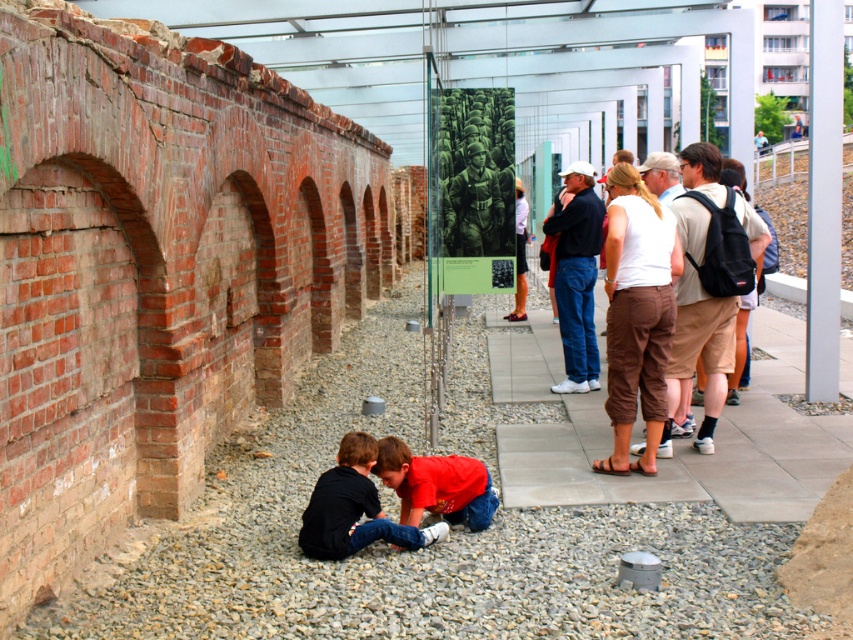
Question: Does red cotton shirt at lower center have a lesser width compared to brown cotton shorts at center-right?

Choices:
 (A) yes
 (B) no

Answer: (B)

Question: Can you confirm if red cotton shirt at lower center is thinner than brown cotton shorts at center-right?

Choices:
 (A) yes
 (B) no

Answer: (B)

Question: Among these objects, which one is nearest to the camera?

Choices:
 (A) black cotton shirt at lower center
 (B) dark blue jeans at center
 (C) red cotton shirt at lower center
 (D) gray gravel at lower center

Answer: (A)

Question: Which point is closer to the camera?

Choices:
 (A) (688, 304)
 (B) (351, 513)
 (C) (448, 458)

Answer: (B)

Question: Does gray gravel at lower center appear on the right side of brown cotton shorts at center-right?

Choices:
 (A) no
 (B) yes

Answer: (A)

Question: Which of these objects is positioned farthest from the red cotton shirt at lower center?

Choices:
 (A) black cotton shirt at lower center
 (B) khaki shorts at center

Answer: (B)